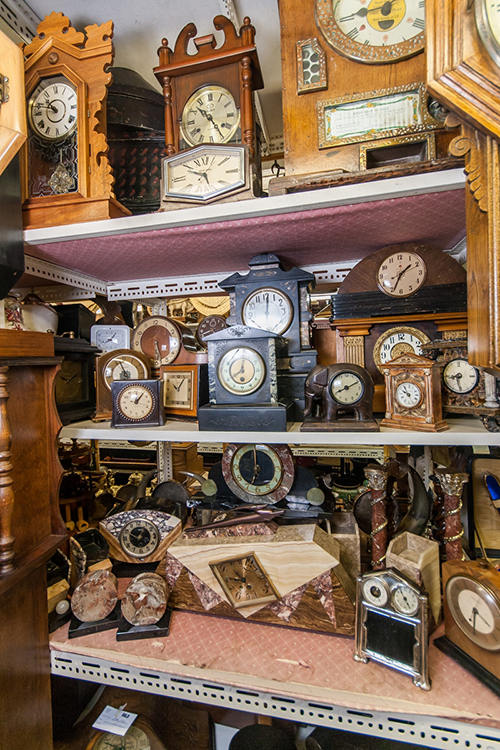
The image size is (500, 750). Find the location of `drink coasters`. drink coasters is located at coordinates coord(93,596), coord(107,576), coord(140,600), coord(152,580).